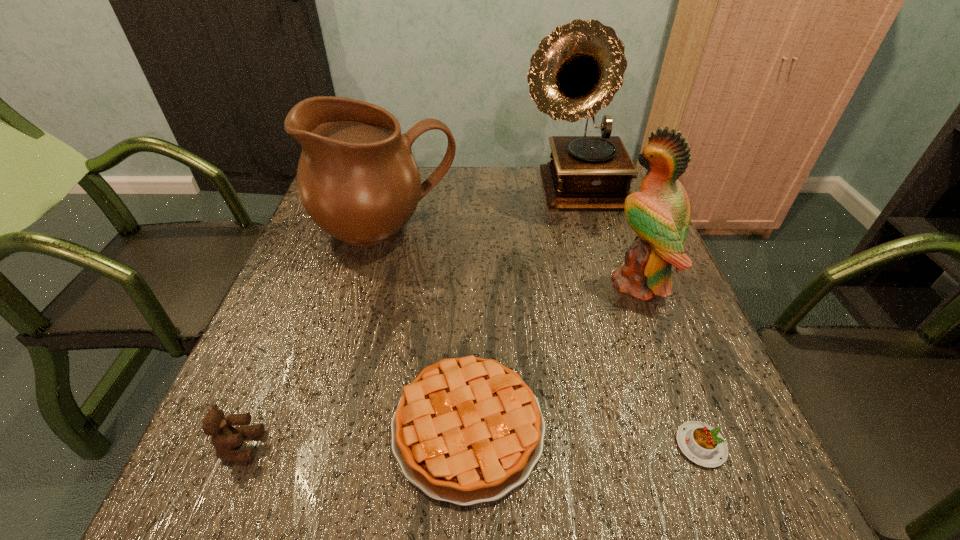
Locate an element on the screen. The image size is (960, 540). teddy bear located at the left edge is located at coordinates (225, 437).

The image size is (960, 540). Find the location of `record player situated at the right edge`. record player situated at the right edge is located at coordinates (576, 71).

At what (x,y) coordinates should I click in order to perform the action: click on parrot that is at the right edge. Please return your answer as a coordinate pair (x, y). This screenshot has height=540, width=960. Looking at the image, I should click on (659, 214).

This screenshot has height=540, width=960. Find the location of `pudding located in the right edge section of the desktop`. pudding located in the right edge section of the desktop is located at coordinates (704, 445).

At what (x,y) coordinates should I click in order to perform the action: click on object that is at the far left corner. Please return your answer as a coordinate pair (x, y). The image size is (960, 540). Looking at the image, I should click on (357, 178).

I want to click on object at the near left corner, so tap(225, 437).

In order to click on object positioned at the far right corner in this screenshot , I will do `click(576, 71)`.

The height and width of the screenshot is (540, 960). In order to click on object that is at the near right corner in this screenshot , I will do `click(704, 445)`.

Find the location of a particular element. free region at the near edge of the desktop is located at coordinates (616, 507).

Find the location of a particular element. The width and height of the screenshot is (960, 540). vacant space at the left edge of the desktop is located at coordinates (299, 372).